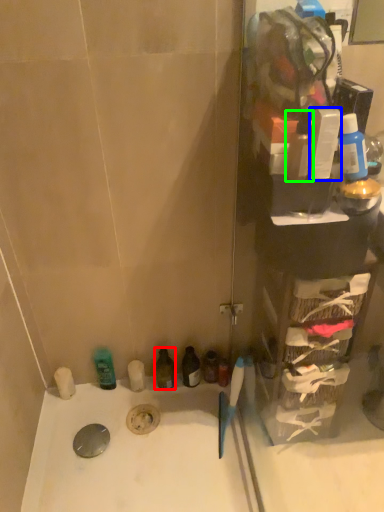
Question: Which object is the farthest from mouthwash (highlighted by a red box)? Choose among these: toiletry (highlighted by a blue box) or mouthwash (highlighted by a green box).

Choices:
 (A) toiletry
 (B) mouthwash

Answer: (A)